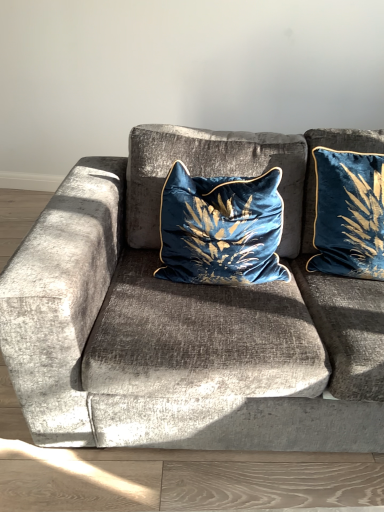
The width and height of the screenshot is (384, 512). What are the coordinates of `velvet blue pillow at center, which ranks as the 1th pillow in left-to-right order` in the screenshot? It's located at (221, 229).

In order to click on the 2nd pillow positioned above the velvet cushion at center (from the image's perspective) in this screenshot , I will do `click(348, 214)`.

Who is shorter, velvet blue pillow at upper right, which appears as the 2th pillow when viewed from the left, or velvet cushion at center?

With less height is velvet blue pillow at upper right, which appears as the 2th pillow when viewed from the left.

From the picture: Is velvet blue pillow at upper right, which appears as the 2th pillow when viewed from the left, facing away from velvet cushion at center?

Yes, velvet blue pillow at upper right, which appears as the 2th pillow when viewed from the left, is facing away from velvet cushion at center.

Which of these two, velvet cushion at center or velvet blue pillow at center, the 2th pillow from the right, is wider?

Wider between the two is velvet cushion at center.

Who is shorter, velvet cushion at center or velvet blue pillow at center, which ranks as the 1th pillow in left-to-right order?

Standing shorter between the two is velvet blue pillow at center, which ranks as the 1th pillow in left-to-right order.

Is velvet cushion at center positioned beyond the bounds of velvet blue pillow at center, the 2th pillow from the right?

velvet cushion at center is positioned outside velvet blue pillow at center, the 2th pillow from the right.

Considering the positions of point (38, 268) and point (238, 283), is point (38, 268) closer or farther from the camera than point (238, 283)?

Point (38, 268) is closer to the camera than point (238, 283).

Which is more to the right, velvet blue pillow at center, which ranks as the 1th pillow in left-to-right order, or velvet cushion at center?

Positioned to the right is velvet cushion at center.

From the picture: Is velvet blue pillow at center, which ranks as the 1th pillow in left-to-right order, positioned with its back to velvet cushion at center?

That's right, velvet blue pillow at center, which ranks as the 1th pillow in left-to-right order, is facing away from velvet cushion at center.

There is a velvet cushion at center. Identify the location of the 1st pillow above it (from a real-world perspective). This screenshot has width=384, height=512. (221, 229).

Can velvet cushion at center be found inside velvet blue pillow at center, which ranks as the 1th pillow in left-to-right order?

Actually, velvet cushion at center is outside velvet blue pillow at center, which ranks as the 1th pillow in left-to-right order.

From a real-world perspective, between velvet cushion at center and velvet blue pillow at upper right, which appears as the 2th pillow when viewed from the left, who is vertically higher?

velvet blue pillow at upper right, which appears as the 2th pillow when viewed from the left, from a real-world perspective.

Image resolution: width=384 pixels, height=512 pixels. What are the coordinates of `the 2nd pillow positioned above the velvet cushion at center (from a real-world perspective)` in the screenshot? It's located at (348, 214).

Can you tell me how much velvet cushion at center and velvet blue pillow at upper right, which is the first pillow from right to left, differ in facing direction?

The facing directions of velvet cushion at center and velvet blue pillow at upper right, which is the first pillow from right to left, are 7.87 degrees apart.

Is velvet cushion at center positioned with its back to velvet blue pillow at upper right, which is the first pillow from right to left?

Yes, velvet cushion at center is positioned with its back facing velvet blue pillow at upper right, which is the first pillow from right to left.

Is velvet blue pillow at upper right, which is the first pillow from right to left, wider or thinner than velvet blue pillow at center, the 2th pillow from the right?

Considering their sizes, velvet blue pillow at upper right, which is the first pillow from right to left, looks slimmer than velvet blue pillow at center, the 2th pillow from the right.

Is velvet blue pillow at upper right, which appears as the 2th pillow when viewed from the left, closer to camera compared to velvet blue pillow at center, the 2th pillow from the right?

That is False.

Is velvet blue pillow at upper right, which is the first pillow from right to left, facing towards velvet blue pillow at center, the 2th pillow from the right?

No, velvet blue pillow at upper right, which is the first pillow from right to left, is not facing towards velvet blue pillow at center, the 2th pillow from the right.

Does velvet blue pillow at center, the 2th pillow from the right, turn towards velvet blue pillow at upper right, which appears as the 2th pillow when viewed from the left?

No, velvet blue pillow at center, the 2th pillow from the right, is not facing towards velvet blue pillow at upper right, which appears as the 2th pillow when viewed from the left.

Is velvet blue pillow at center, the 2th pillow from the right, wider or thinner than velvet blue pillow at upper right, which is the first pillow from right to left?

Considering their sizes, velvet blue pillow at center, the 2th pillow from the right, looks broader than velvet blue pillow at upper right, which is the first pillow from right to left.

Considering the relative positions of velvet blue pillow at center, which ranks as the 1th pillow in left-to-right order, and velvet blue pillow at upper right, which is the first pillow from right to left, in the image provided, is velvet blue pillow at center, which ranks as the 1th pillow in left-to-right order, to the right of velvet blue pillow at upper right, which is the first pillow from right to left, from the viewer's perspective?

No, velvet blue pillow at center, which ranks as the 1th pillow in left-to-right order, is not to the right of velvet blue pillow at upper right, which is the first pillow from right to left.

Considering the relative sizes of velvet blue pillow at center, which ranks as the 1th pillow in left-to-right order, and velvet blue pillow at upper right, which is the first pillow from right to left, in the image provided, is velvet blue pillow at center, which ranks as the 1th pillow in left-to-right order, bigger than velvet blue pillow at upper right, which is the first pillow from right to left,?

Correct, velvet blue pillow at center, which ranks as the 1th pillow in left-to-right order, is larger in size than velvet blue pillow at upper right, which is the first pillow from right to left.

From a real-world perspective, which pillow is the 2nd one above the velvet cushion at center? Please provide its 2D coordinates.

[(348, 214)]

Find the location of a particular element. studio couch below the velvet blue pillow at center, which ranks as the 1th pillow in left-to-right order (from the image's perspective) is located at coordinates (188, 314).

From the image, which object appears to be farther from velvet cushion at center, velvet blue pillow at center, which ranks as the 1th pillow in left-to-right order, or velvet blue pillow at upper right, which appears as the 2th pillow when viewed from the left?

velvet blue pillow at upper right, which appears as the 2th pillow when viewed from the left.

Looking at the image, which one is located further to velvet blue pillow at upper right, which appears as the 2th pillow when viewed from the left, velvet cushion at center or velvet blue pillow at center, which ranks as the 1th pillow in left-to-right order?

The object further to velvet blue pillow at upper right, which appears as the 2th pillow when viewed from the left, is velvet cushion at center.

Considering their positions, is velvet cushion at center positioned closer to velvet blue pillow at center, which ranks as the 1th pillow in left-to-right order, than velvet blue pillow at upper right, which is the first pillow from right to left?

Among the two, velvet cushion at center is located nearer to velvet blue pillow at center, which ranks as the 1th pillow in left-to-right order.

Looking at the image, which one is located further to velvet blue pillow at center, which ranks as the 1th pillow in left-to-right order, velvet blue pillow at upper right, which is the first pillow from right to left, or velvet cushion at center?

The object further to velvet blue pillow at center, which ranks as the 1th pillow in left-to-right order, is velvet blue pillow at upper right, which is the first pillow from right to left.

Estimate the real-world distances between objects in this image. Which object is further from velvet cushion at center, velvet blue pillow at upper right, which appears as the 2th pillow when viewed from the left, or velvet blue pillow at center, which ranks as the 1th pillow in left-to-right order?

velvet blue pillow at upper right, which appears as the 2th pillow when viewed from the left.

Which object lies further to the anchor point velvet blue pillow at upper right, which is the first pillow from right to left, velvet blue pillow at center, the 2th pillow from the right, or velvet cushion at center?

The object further to velvet blue pillow at upper right, which is the first pillow from right to left, is velvet cushion at center.

In order to click on pillow between velvet cushion at center and velvet blue pillow at upper right, which is the first pillow from right to left, along the z-axis in this screenshot , I will do `click(221, 229)`.